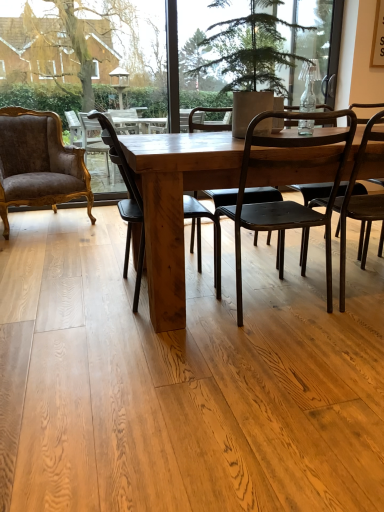
Locate an element on the screen. free space that is in between matte black chair at right, positioned as the 4th chair in left-to-right order, and matte black chair at center, which appears as the second chair when viewed from the right is located at coordinates (318, 300).